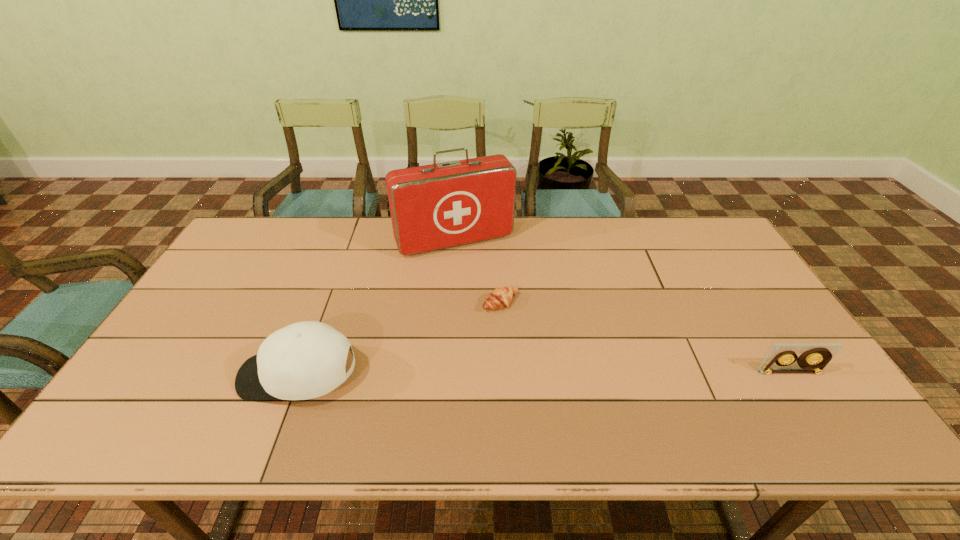
Locate an element on the screen. The height and width of the screenshot is (540, 960). free space located at the front of the second shortest object with visible reels is located at coordinates (809, 403).

You are a GUI agent. You are given a task and a screenshot of the screen. Output one action in this format:
    pyautogui.click(x=<x>, y=<y>)
    Task: Click on the blank space located 0.280m on the side of the tallest object with the first aid cross symbol
    This screenshot has height=540, width=960.
    Given the screenshot: What is the action you would take?
    pyautogui.click(x=503, y=319)

Locate an element on the screen. This screenshot has width=960, height=540. vacant space located 0.230m on the side of the tallest object with the first aid cross symbol is located at coordinates (497, 307).

The image size is (960, 540). I want to click on vacant space situated 0.200m on the side of the tallest object with the first aid cross symbol, so click(493, 300).

Find the location of a particular element. The width and height of the screenshot is (960, 540). free space located on the front-facing side of the shortest object is located at coordinates (603, 383).

Identify the location of free location located on the front-facing side of the shortest object. pyautogui.click(x=543, y=336).

Image resolution: width=960 pixels, height=540 pixels. I want to click on free spot located 0.110m on the front-facing side of the shortest object, so click(x=540, y=334).

Find the location of a particular element. The height and width of the screenshot is (540, 960). object at the far edge is located at coordinates (436, 206).

Image resolution: width=960 pixels, height=540 pixels. I want to click on baseball cap at the near edge, so click(x=305, y=360).

This screenshot has width=960, height=540. In order to click on videotape that is at the near edge in this screenshot , I will do `click(814, 357)`.